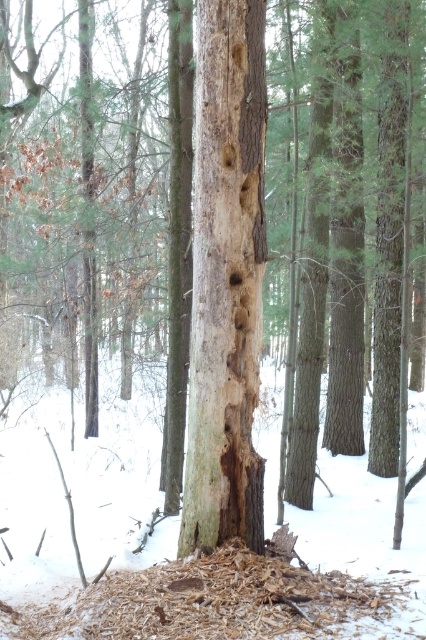
Who is more distant from viewer, (57, 497) or (213, 312)?

Point (57, 497)

What are the coordinates of `white powdery snow at center` in the screenshot? It's located at (176, 538).